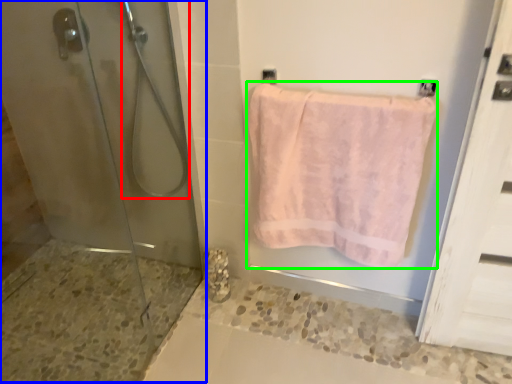
Question: Considering the real-world distances, which object is closest to shower (highlighted by a red box)? shower door (highlighted by a blue box) or towel (highlighted by a green box).

Choices:
 (A) shower door
 (B) towel

Answer: (A)